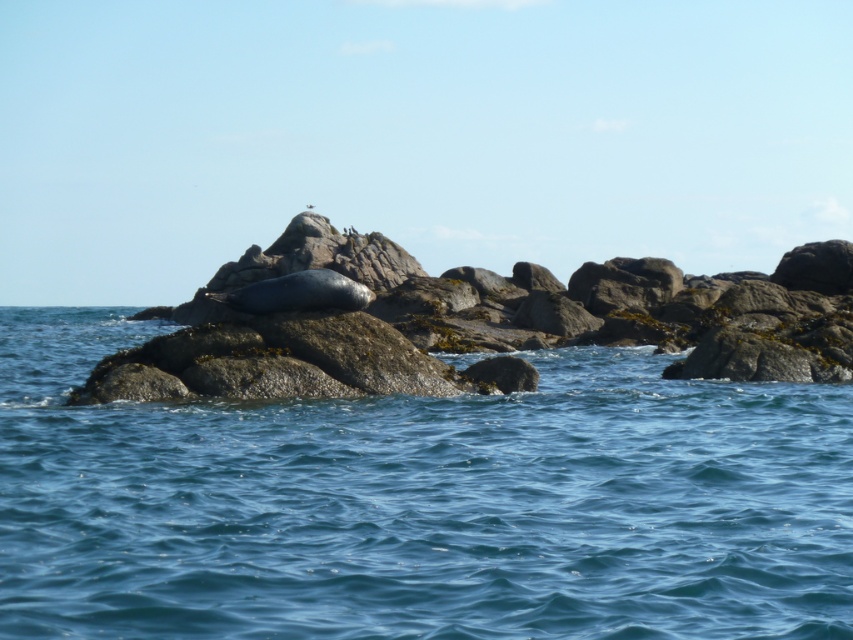
Based on the photo, who is shorter, blue water at center or gray matte seal at center?

Standing shorter between the two is gray matte seal at center.

Does blue water at center have a greater width compared to gray matte seal at center?

Correct, the width of blue water at center exceeds that of gray matte seal at center.

Where is `blue water at center`? The width and height of the screenshot is (853, 640). blue water at center is located at coordinates (418, 502).

Is point (567, 531) positioned in front of point (305, 262)?

Yes, it is in front of point (305, 262).

Consider the image. Who is more forward, (476, 406) or (195, 314)?

Point (476, 406) is more forward.

Is point (561, 486) closer to viewer compared to point (659, 323)?

Yes, point (561, 486) is in front of point (659, 323).

What are the coordinates of `blue water at center` in the screenshot? It's located at (418, 502).

Can you confirm if smooth gray rock at center is bigger than gray matte seal at center?

Yes.

Describe the element at coordinates (473, 323) in the screenshot. I see `smooth gray rock at center` at that location.

You are a GUI agent. You are given a task and a screenshot of the screen. Output one action in this format:
    pyautogui.click(x=<x>, y=<y>)
    Task: Click on the smooth gray rock at center
    Image resolution: width=853 pixels, height=640 pixels.
    Given the screenshot: What is the action you would take?
    pyautogui.click(x=473, y=323)